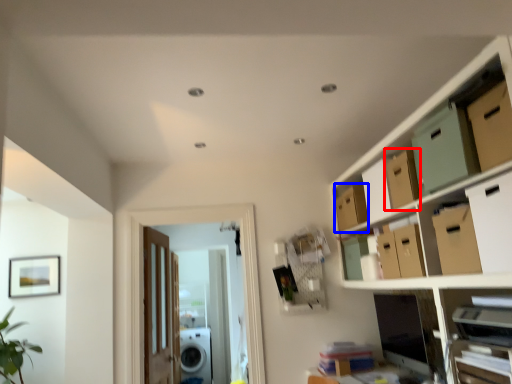
Question: Which object is closer to the camera taking this photo, cardboard box (highlighted by a red box) or storage box (highlighted by a blue box)?

Choices:
 (A) cardboard box
 (B) storage box

Answer: (A)